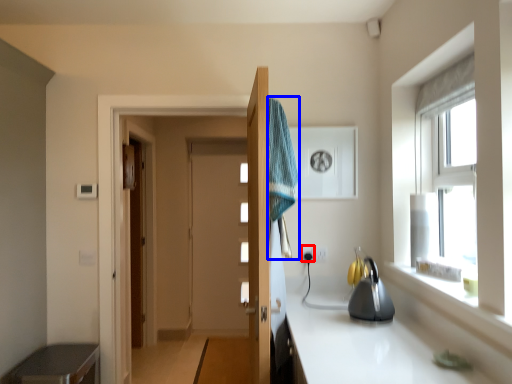
Question: Which object is further to the camera taking this photo, electric outlet (highlighted by a red box) or bath towel (highlighted by a blue box)?

Choices:
 (A) electric outlet
 (B) bath towel

Answer: (A)